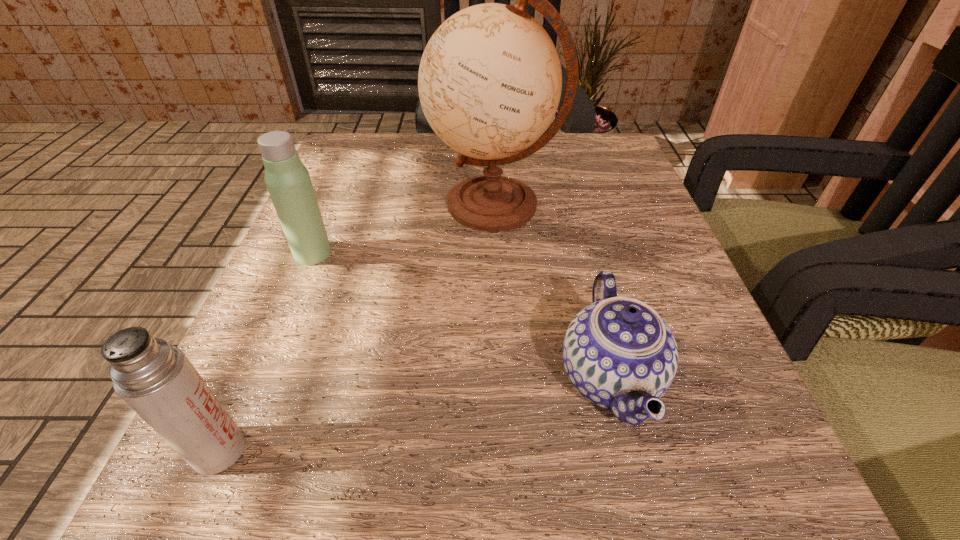
Identify the location of free space that is in between the farther thermos bottle and the chinaware. Image resolution: width=960 pixels, height=540 pixels. (461, 316).

Where is `empty space that is in between the second farthest object and the chinaware`? empty space that is in between the second farthest object and the chinaware is located at coordinates (461, 316).

The image size is (960, 540). I want to click on vacant space that is in between the tallest object and the second farthest object, so click(x=404, y=229).

This screenshot has width=960, height=540. Find the location of `free space between the chinaware and the nearer thermos bottle`. free space between the chinaware and the nearer thermos bottle is located at coordinates (415, 415).

Where is `empty space between the nearer thermos bottle and the shortest object`? This screenshot has width=960, height=540. empty space between the nearer thermos bottle and the shortest object is located at coordinates (415, 415).

At what (x,y) coordinates should I click in order to perform the action: click on vacant space that's between the globe and the chinaware. Please return your answer as a coordinate pair (x, y). Image resolution: width=960 pixels, height=540 pixels. Looking at the image, I should click on (552, 292).

Identify which object is the third nearest to the nearer thermos bottle. Please provide its 2D coordinates. Your answer should be formatted as a tuple, i.e. [(x, y)], where the tuple contains the x and y coordinates of a point satisfying the conditions above.

[(490, 80)]

The image size is (960, 540). Identify the location of object that is the third closest to the tallest object. (156, 379).

This screenshot has height=540, width=960. I want to click on vacant space that satisfies the following two spatial constraints: 1. at the spout of the chinaware; 2. on the front side of the nearer thermos bottle, so click(628, 450).

The height and width of the screenshot is (540, 960). What are the coordinates of `vacant space that satisfies the following two spatial constraints: 1. on the surface of the tallest object; 2. on the front side of the second farthest object` in the screenshot? It's located at (496, 253).